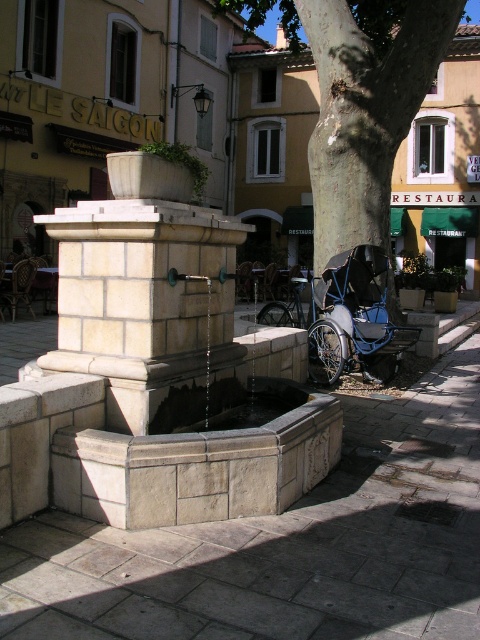
Question: Estimate the real-world distances between objects in this image. Which object is closer to the stone pavement at center?

Choices:
 (A) blue metallic baby carriage at center
 (B) white stone fountain at center

Answer: (B)

Question: Estimate the real-world distances between objects in this image. Which object is closer to the smooth bark tree at center?

Choices:
 (A) blue metallic baby carriage at center
 (B) stone pavement at center
 (C) white stone fountain at center

Answer: (A)

Question: Does stone pavement at center have a greater width compared to smooth bark tree at center?

Choices:
 (A) no
 (B) yes

Answer: (A)

Question: Considering the relative positions of smooth bark tree at center and blue metallic baby carriage at center in the image provided, where is smooth bark tree at center located with respect to blue metallic baby carriage at center?

Choices:
 (A) above
 (B) below

Answer: (A)

Question: Which point is closer to the camera?

Choices:
 (A) (412, 24)
 (B) (275, 627)

Answer: (B)

Question: Does smooth bark tree at center appear under blue metallic baby carriage at center?

Choices:
 (A) yes
 (B) no

Answer: (B)